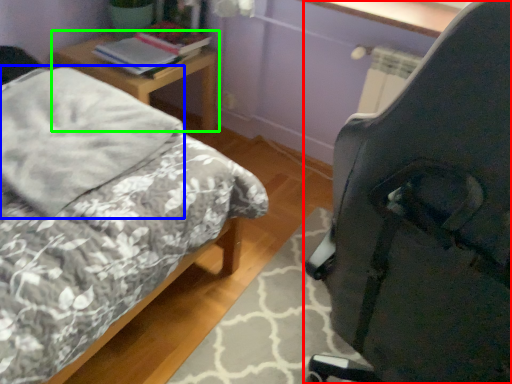
Question: Considering the real-world distances, which object is farthest from chair (highlighted by a red box)? pillow (highlighted by a blue box) or nightstand (highlighted by a green box)?

Choices:
 (A) pillow
 (B) nightstand

Answer: (B)